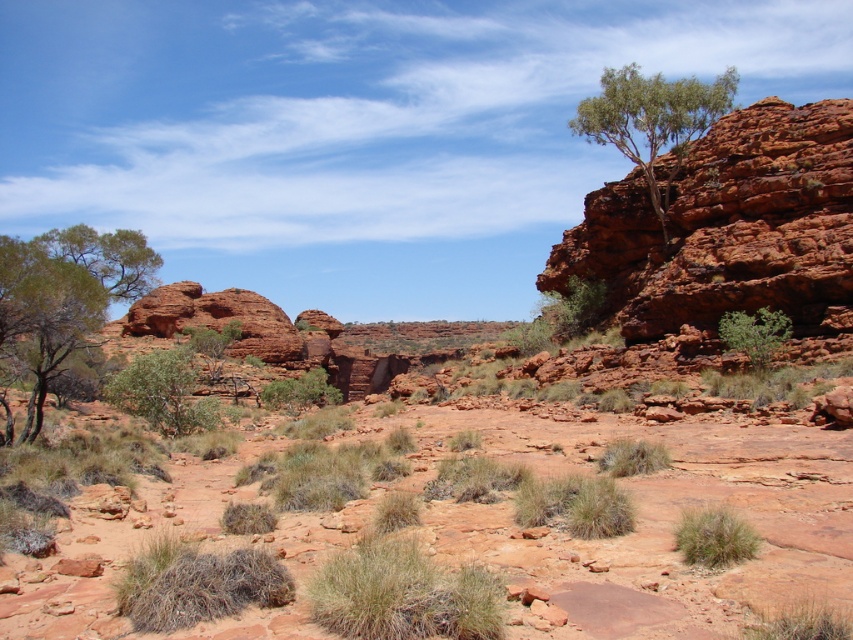
Question: Estimate the real-world distances between objects in this image. Which object is closer to the green leafy tree at upper right?

Choices:
 (A) green leafy shrub at center-right
 (B) green grassy bush at center

Answer: (A)

Question: Can you confirm if green leafy tree at upper right is bigger than green grassy bush at center?

Choices:
 (A) no
 (B) yes

Answer: (B)

Question: Can you confirm if green leafy tree at upper right is positioned below green leafy tree at center?

Choices:
 (A) yes
 (B) no

Answer: (B)

Question: Which object is the closest to the green leafy tree at center?

Choices:
 (A) green grassy bush at center
 (B) green leafy shrub at center-right
 (C) rusty-red rock at upper right

Answer: (B)

Question: Is green leafy tree at upper right above green grassy bush at center?

Choices:
 (A) no
 (B) yes

Answer: (B)

Question: Which object is positioned farthest from the green leafy tree at upper right?

Choices:
 (A) green grassy bush at center
 (B) green leafy tree at center
 (C) green leafy tree at left

Answer: (C)